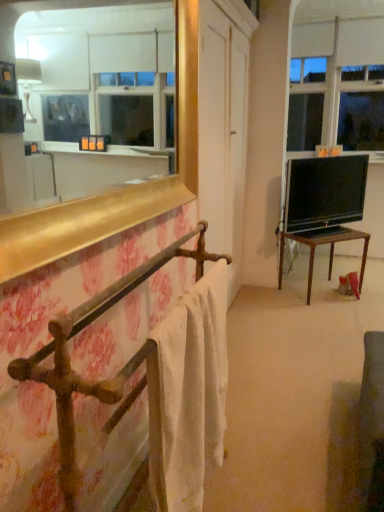
Image resolution: width=384 pixels, height=512 pixels. Identify the location of vacant space situated above transparent glass window at upper right (from a real-world perspective). (338, 8).